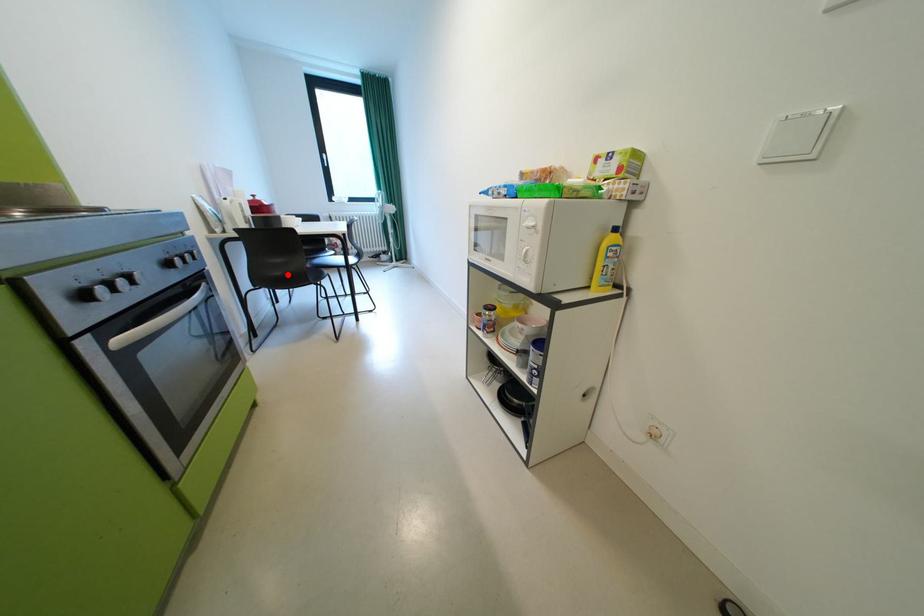
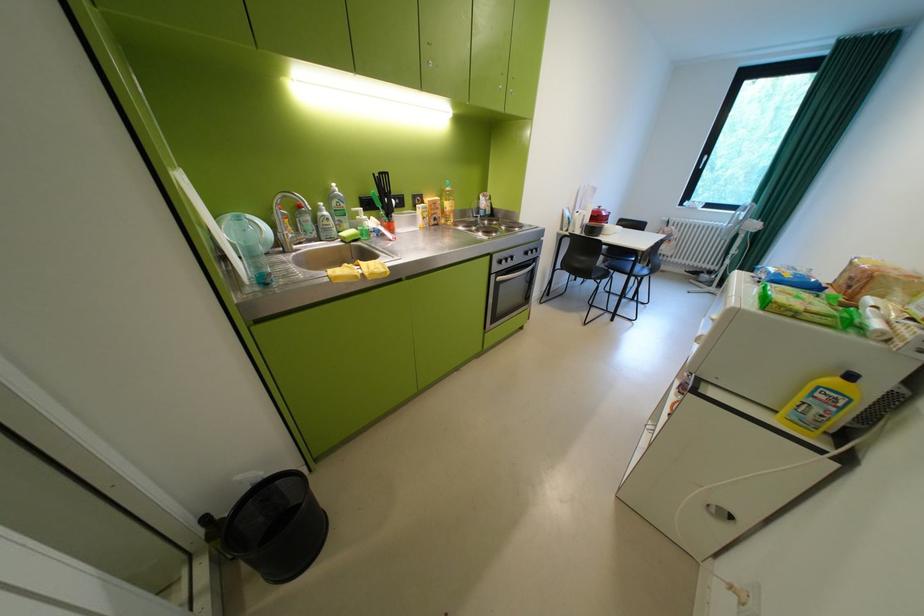
The point at the highlighted location is marked in the first image. Where is the corresponding point in the second image?

(587, 265)